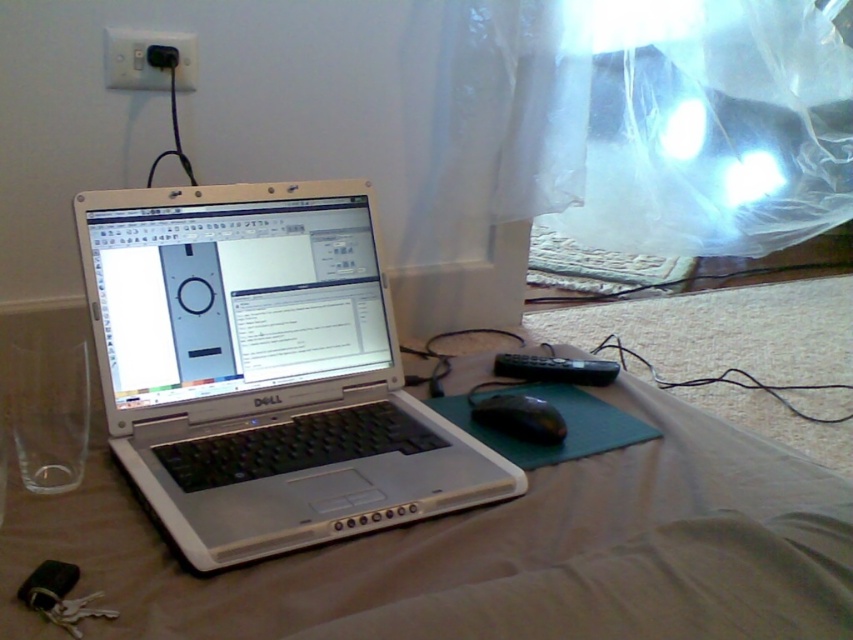
You are a photographer setting up a shot of the workspace. You notice two points marked in the image at coordinates point (161, 33) and point (520, 417). Which point is closer to the camera?

Point (161, 33) is further to the camera than point (520, 417), so point (520, 417) is closer to the camera.

From the picture: You are a delivery robot that needs to place a package between the silver metallic laptop at center and the black plastic mouse at lower center. The package requires 10 inches of space. Can you fit the package there?

The silver metallic laptop at center is 9.68 inches away from the black plastic mouse at lower center. Since the required space is 10 inches, the package cannot be placed between them as the available space is insufficient.

You are organizing cables and devices in the workspace shown. You have a drawer that can only hold items smaller than the black plastic mouse at lower center. Can the black plastic plug at upper left fit in the drawer?

The black plastic plug at upper left has a smaller size compared to the black plastic mouse at lower center. Since the drawer can hold items smaller than the mouse, the plug should fit.